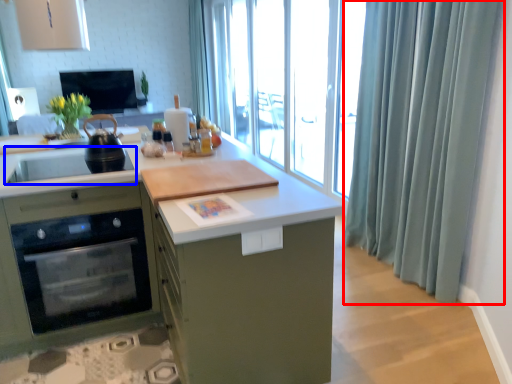
Question: Which of the following is the closest to the observer, shower curtain (highlighted by a red box) or sink (highlighted by a blue box)?

Choices:
 (A) shower curtain
 (B) sink

Answer: (A)